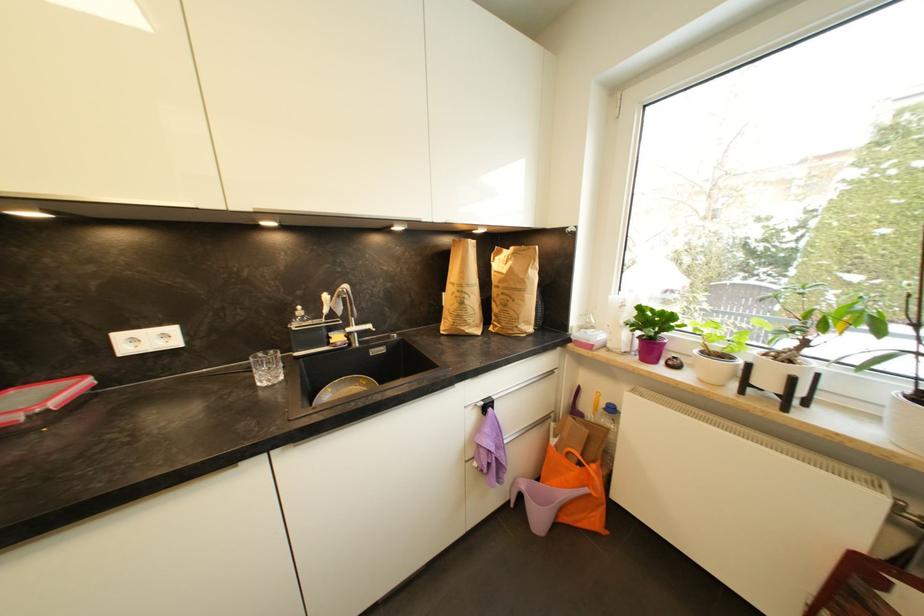
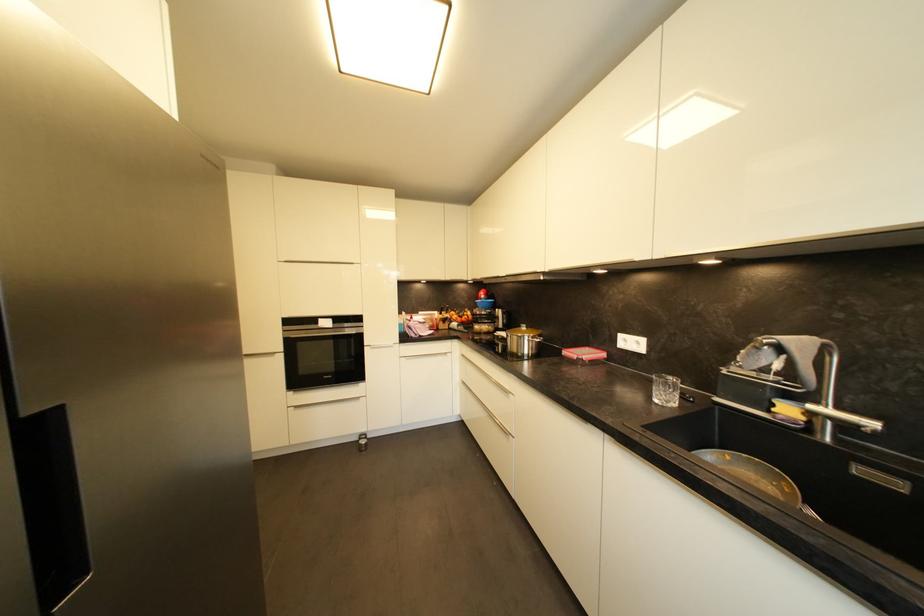
The point at (55, 381) is marked in the first image. Where is the corresponding point in the second image?

(602, 350)